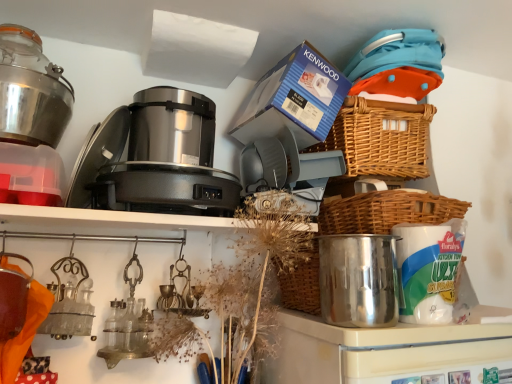
Question: Should I look upward or downward to see blue cardboard box at upper center?

Choices:
 (A) down
 (B) up

Answer: (B)

Question: From a real-world perspective, is blue cardboard box at upper center on top of woven brown basket at upper right, the 1th basket when ordered from top to bottom?

Choices:
 (A) yes
 (B) no

Answer: (A)

Question: Is blue cardboard box at upper center completely or partially outside of woven brown basket at upper right, the 1th basket when ordered from top to bottom?

Choices:
 (A) no
 (B) yes

Answer: (B)

Question: Can you confirm if blue cardboard box at upper center is wider than woven brown basket at upper right, the 1th basket when ordered from top to bottom?

Choices:
 (A) yes
 (B) no

Answer: (A)

Question: From a real-world perspective, does blue cardboard box at upper center sit lower than woven brown basket at upper right, acting as the second basket starting from the bottom?

Choices:
 (A) yes
 (B) no

Answer: (B)

Question: Does blue cardboard box at upper center appear on the right side of woven brown basket at upper right, the 1th basket when ordered from top to bottom?

Choices:
 (A) no
 (B) yes

Answer: (A)

Question: Would you say blue cardboard box at upper center contains woven brown basket at upper right, the 1th basket when ordered from top to bottom?

Choices:
 (A) no
 (B) yes

Answer: (A)

Question: Is woven brown basket at right, the 2th basket from the top, positioned far away from woven brown basket at upper right, acting as the second basket starting from the bottom?

Choices:
 (A) yes
 (B) no

Answer: (B)

Question: Considering the relative positions of woven brown basket at right, the 2th basket from the top, and woven brown basket at upper right, the 1th basket when ordered from top to bottom, in the image provided, is woven brown basket at right, the 2th basket from the top, behind woven brown basket at upper right, the 1th basket when ordered from top to bottom,?

Choices:
 (A) yes
 (B) no

Answer: (B)

Question: Is woven brown basket at right, arranged as the first basket when ordered from the bottom, looking in the opposite direction of woven brown basket at upper right, the 1th basket when ordered from top to bottom?

Choices:
 (A) yes
 (B) no

Answer: (B)

Question: Can you confirm if woven brown basket at right, arranged as the first basket when ordered from the bottom, is wider than woven brown basket at upper right, the 1th basket when ordered from top to bottom?

Choices:
 (A) yes
 (B) no

Answer: (B)

Question: Is woven brown basket at right, the 2th basket from the top, closer to camera compared to woven brown basket at upper right, acting as the second basket starting from the bottom?

Choices:
 (A) yes
 (B) no

Answer: (A)

Question: From a real-world perspective, is woven brown basket at right, arranged as the first basket when ordered from the bottom, over woven brown basket at upper right, the 1th basket when ordered from top to bottom?

Choices:
 (A) yes
 (B) no

Answer: (B)

Question: Can we say shiny metallic pot at center-right, acting as the second appliance starting from the back, lies outside blue cardboard box at upper center?

Choices:
 (A) yes
 (B) no

Answer: (A)